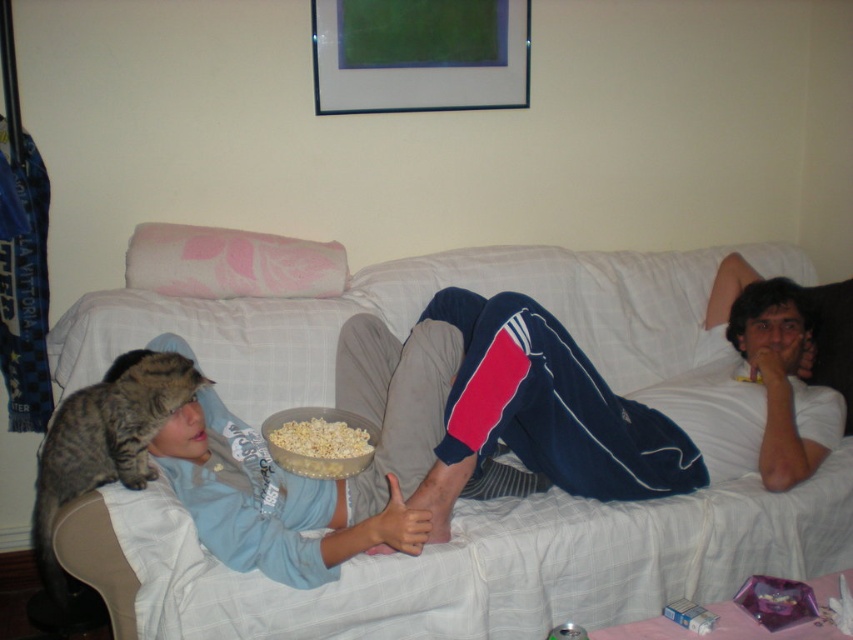
You are a delivery robot that needs to place a small package on the floor between the blue track pants at center and the tabby fur cat at left. Can you fit the package between them without moving either object?

The blue track pants at center is bigger than the tabby fur cat at left, so there might be enough space between them to fit the small package. However, since the exact distance isn

You are a delivery robot trying to place a small package on the white popcorn at center. Can you put it there without stepping on the blue track pants at center?

The blue track pants at center is positioned over white popcorn at center, so placing the package on the white popcorn at center would require moving the blue track pants at center first to avoid stepping on them.